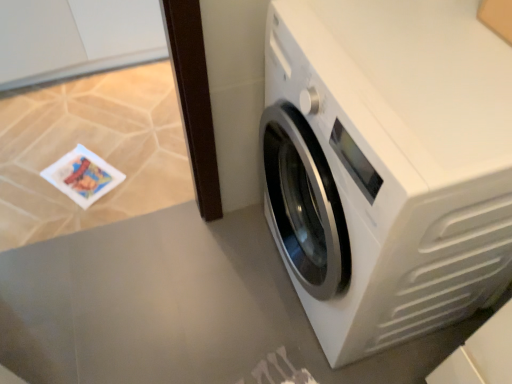
What do you see at coordinates (178, 309) in the screenshot? The width and height of the screenshot is (512, 384). I see `white glossy table top at lower right` at bounding box center [178, 309].

Locate an element on the screen. This screenshot has width=512, height=384. white glossy table top at lower right is located at coordinates (178, 309).

Find the location of `white glossy washing machine at right`. white glossy washing machine at right is located at coordinates (387, 165).

In order to face white glossy washing machine at right, should I rotate leftwards or rightwards?

You should look right and rotate roughly 17.508 degrees.

What do you see at coordinates (387, 165) in the screenshot?
I see `white glossy washing machine at right` at bounding box center [387, 165].

Image resolution: width=512 pixels, height=384 pixels. I want to click on white glossy table top at lower right, so click(x=178, y=309).

Between white glossy washing machine at right and white glossy table top at lower right, which one appears on the left side from the viewer's perspective?

Positioned to the left is white glossy table top at lower right.

Which object is further away from the camera, white glossy washing machine at right or white glossy table top at lower right?

white glossy table top at lower right is further away from the camera.

Between point (289, 15) and point (217, 225), which one is positioned behind?

The point (217, 225) is behind.

From the image's perspective, is white glossy washing machine at right located above or below white glossy table top at lower right?

From the image's perspective, white glossy washing machine at right appears above white glossy table top at lower right.

From a real-world perspective, is white glossy washing machine at right on top of white glossy table top at lower right?

Yes, from a real-world perspective, white glossy washing machine at right is over white glossy table top at lower right

In terms of width, does white glossy washing machine at right look wider or thinner when compared to white glossy table top at lower right?

white glossy washing machine at right is thinner than white glossy table top at lower right.

Considering the sizes of objects white glossy washing machine at right and white glossy table top at lower right in the image provided, who is taller, white glossy washing machine at right or white glossy table top at lower right?

white glossy washing machine at right.

Does white glossy washing machine at right have a smaller size compared to white glossy table top at lower right?

Incorrect, white glossy washing machine at right is not smaller in size than white glossy table top at lower right.

Is white glossy washing machine at right positioned beyond the bounds of white glossy table top at lower right?

Yes, white glossy washing machine at right is located beyond the bounds of white glossy table top at lower right.

Is white glossy washing machine at right not near white glossy table top at lower right?

Actually, white glossy washing machine at right and white glossy table top at lower right are a little close together.

Is white glossy washing machine at right oriented away from white glossy table top at lower right?

No, white glossy washing machine at right is not facing away from white glossy table top at lower right.

Measure the distance from white glossy washing machine at right to white glossy table top at lower right.

They are 22.63 inches apart.

Find the location of a particular element. The image size is (512, 384). washing machine above the white glossy table top at lower right (from the image's perspective) is located at coordinates (387, 165).

Which object is positioned more to the right, white glossy table top at lower right or white glossy washing machine at right?

Positioned to the right is white glossy washing machine at right.

Is white glossy table top at lower right closer to the viewer compared to white glossy washing machine at right?

No, it is behind white glossy washing machine at right.

Which point is more forward, (289, 360) or (474, 7)?

The point (474, 7) is more forward.

From the image's perspective, is white glossy table top at lower right on top of white glossy washing machine at right?

No, from the image's perspective, white glossy table top at lower right is not on top of white glossy washing machine at right.

From a real-world perspective, does white glossy table top at lower right sit lower than white glossy washing machine at right?

Yes, from a real-world perspective, white glossy table top at lower right is beneath white glossy washing machine at right.

Between white glossy table top at lower right and white glossy washing machine at right, which one has larger width?

Wider between the two is white glossy table top at lower right.

Does white glossy table top at lower right have a lesser height compared to white glossy washing machine at right?

Correct, white glossy table top at lower right is not as tall as white glossy washing machine at right.

Between white glossy table top at lower right and white glossy washing machine at right, which one has larger size?

white glossy washing machine at right.

Based on the photo, is white glossy table top at lower right situated inside white glossy washing machine at right or outside?

white glossy table top at lower right is spatially situated outside white glossy washing machine at right.

Is white glossy table top at lower right not near white glossy washing machine at right?

No.

Is white glossy table top at lower right positioned with its back to white glossy washing machine at right?

No, white glossy table top at lower right is not facing the opposite direction of white glossy washing machine at right.

What's the angular difference between white glossy table top at lower right and white glossy washing machine at right's facing directions?

90 degrees separate the facing orientations of white glossy table top at lower right and white glossy washing machine at right.

Identify the location of table top below the white glossy washing machine at right (from the image's perspective). (178, 309).

In the image, there is a white glossy washing machine at right. Where is `table top below it (from the image's perspective)`? The height and width of the screenshot is (384, 512). table top below it (from the image's perspective) is located at coordinates [178, 309].

This screenshot has width=512, height=384. I want to click on table top located underneath the white glossy washing machine at right (from a real-world perspective), so click(x=178, y=309).